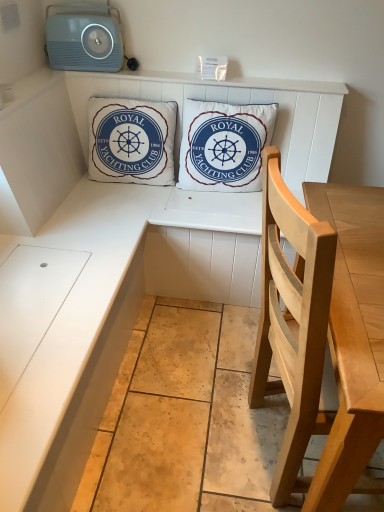
Identify the location of vacant position to the left of light wood chair at right. (178, 428).